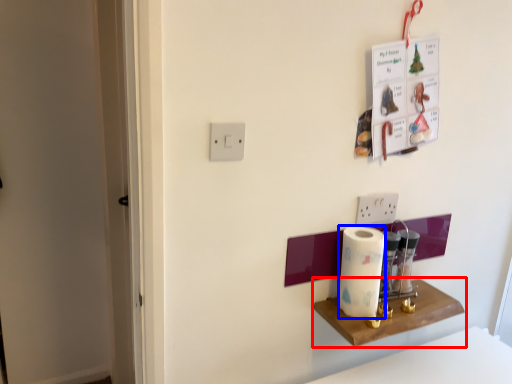
Question: Which point is further to the camera, shelf (highlighted by a red box) or paper towel (highlighted by a blue box)?

Choices:
 (A) shelf
 (B) paper towel

Answer: (B)